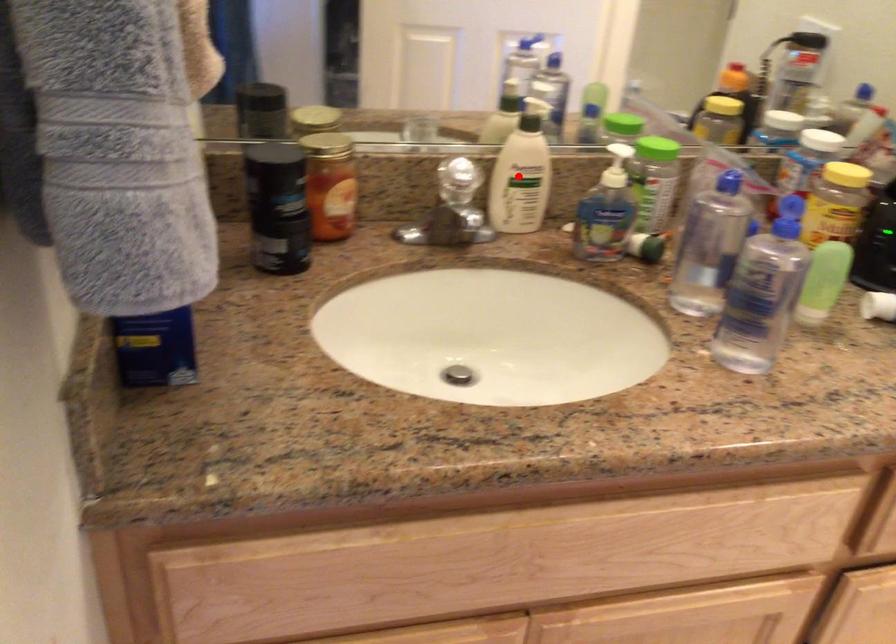
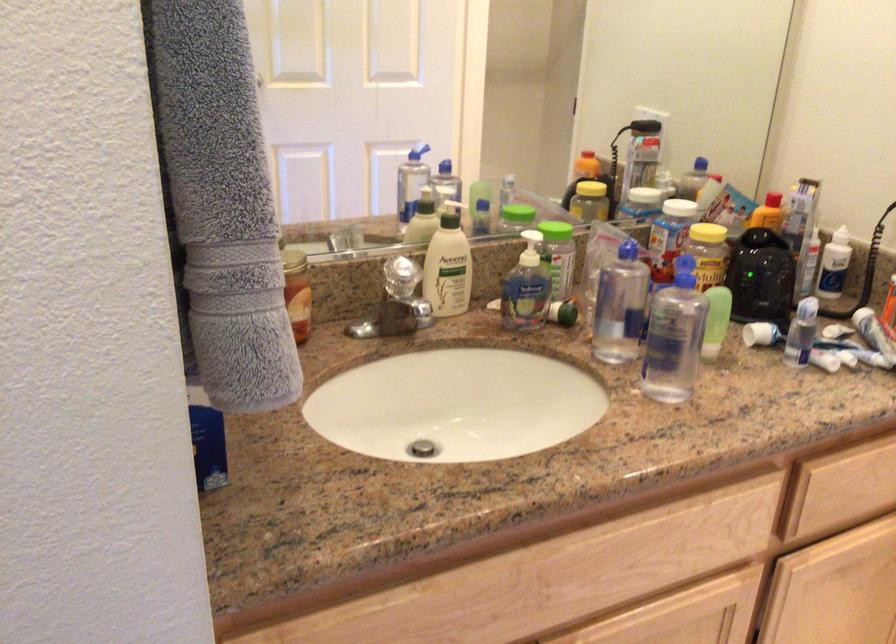
Question: A red point is marked in image1. In image2, is the corresponding 3D point closer to the camera or farther? Reply with the corresponding letter.

Choices:
 (A) The corresponding 3D point is closer.
 (B) The corresponding 3D point is farther.

Answer: (B)